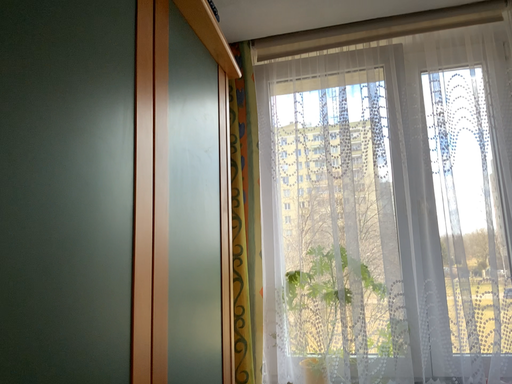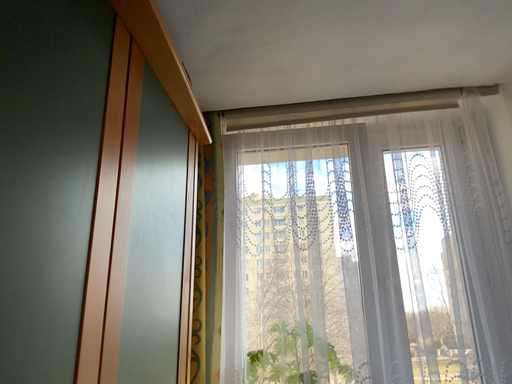
Question: Which way did the camera rotate in the video?

Choices:
 (A) rotated upward
 (B) rotated downward

Answer: (A)